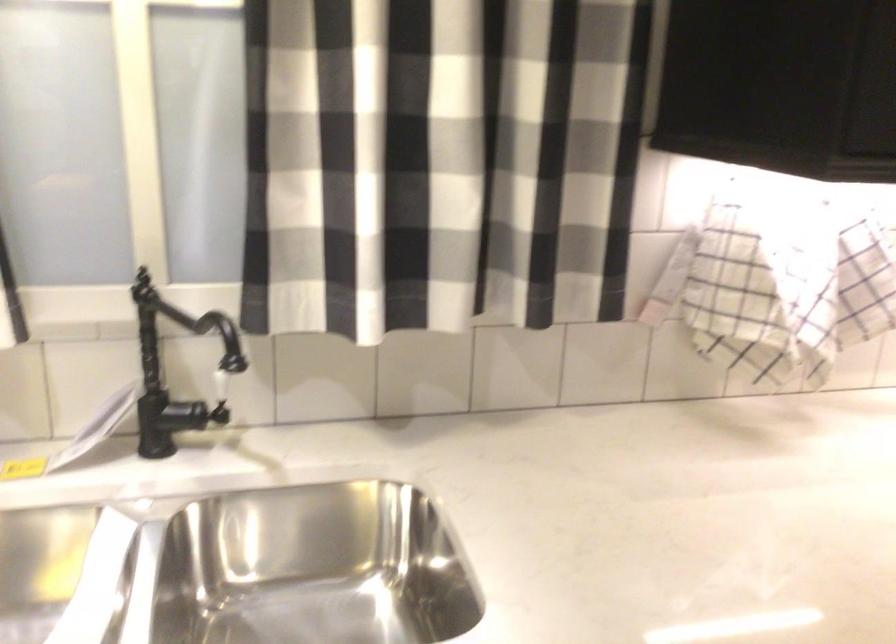
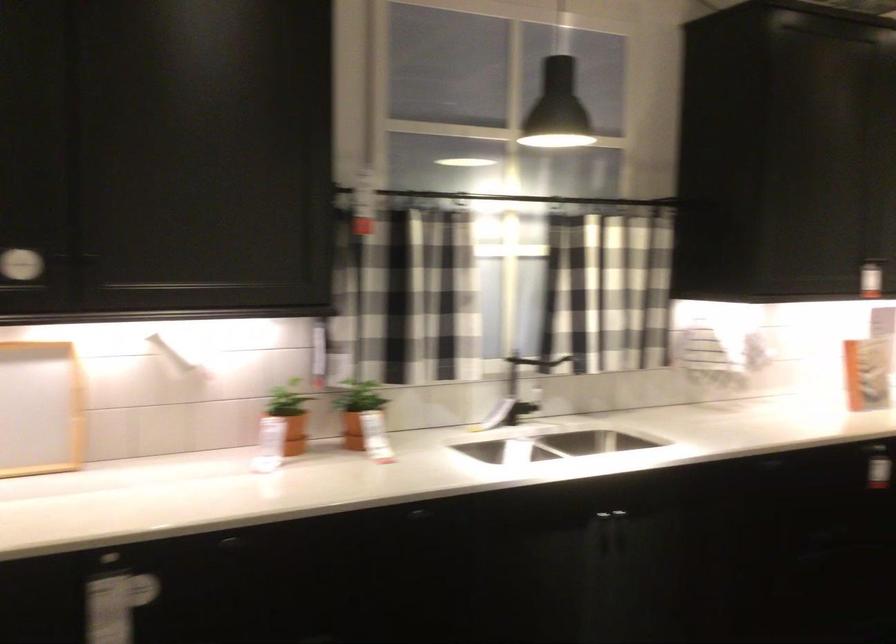
In the second image, find the point that corresponds to point 419,120 in the first image.

(607, 286)